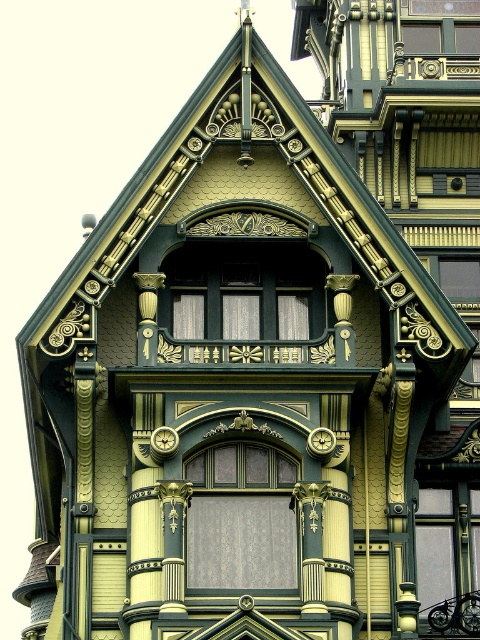
Question: Which object appears closest to the camera in this image?

Choices:
 (A) clear glass window at center
 (B) matte glass window at center

Answer: (B)

Question: Can you confirm if clear glass window at center is positioned to the right of gold metallic clock at center?

Choices:
 (A) no
 (B) yes

Answer: (B)

Question: Considering the real-world distances, which object is closest to the clear glass window at center?

Choices:
 (A) green painted wood column at center
 (B) matte glass window at center

Answer: (B)

Question: Estimate the real-world distances between objects in this image. Which object is closer to the matte black window at center?

Choices:
 (A) green painted wood column at center
 (B) gold metallic clock at center
 (C) clear glass window at center

Answer: (B)

Question: Is matte glass window at center below clear glass window at center?

Choices:
 (A) no
 (B) yes

Answer: (A)

Question: Is matte glass window at center below gold metallic clock at center?

Choices:
 (A) no
 (B) yes

Answer: (B)